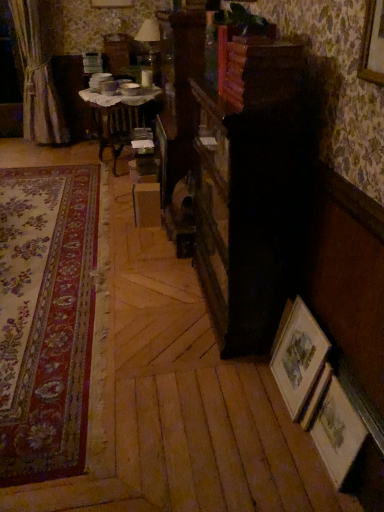
At what (x,y) coordinates should I click in order to perform the action: click on vacant area situated to the left side of wooden picture frame at lower right, which is the 2th picture frame in left-to-right order. Please return your answer as a coordinate pair (x, y). The width and height of the screenshot is (384, 512). Looking at the image, I should click on (286, 464).